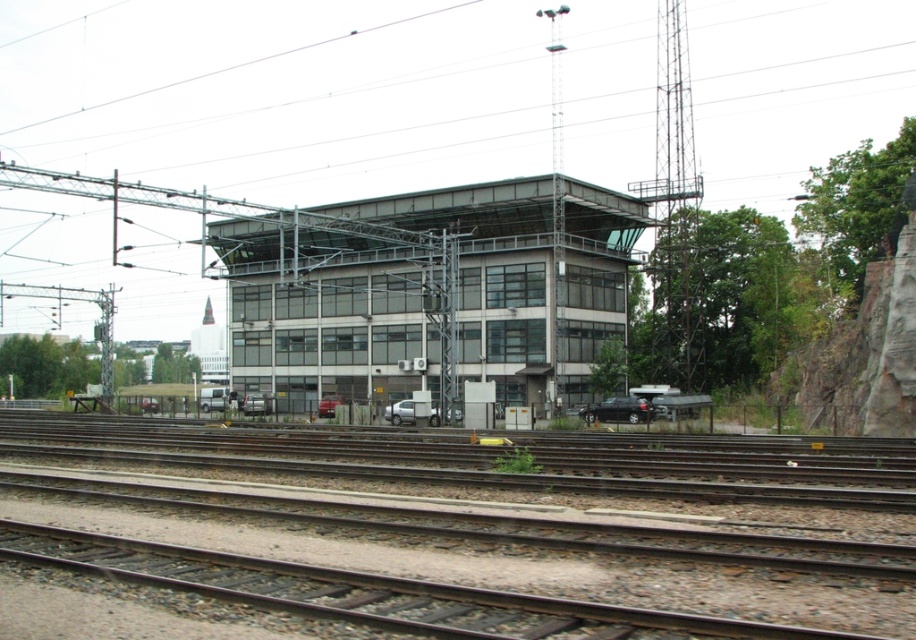
Question: Can you confirm if metallic train tracks at center is positioned below glassy steel building at center?

Choices:
 (A) yes
 (B) no

Answer: (A)

Question: Does metallic train tracks at center appear over glassy steel building at center?

Choices:
 (A) no
 (B) yes

Answer: (A)

Question: Observing the image, what is the correct spatial positioning of metallic train tracks at center in reference to glassy steel building at center?

Choices:
 (A) left
 (B) right

Answer: (B)